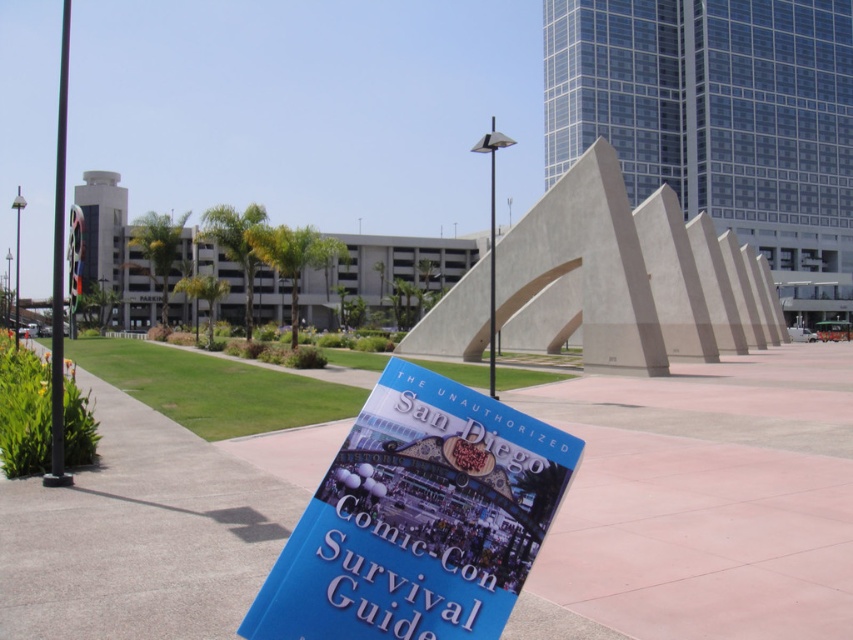
You are a photographer setting up a tripod to take a photo of the blue paper book at center and the black metal pole at left. The tripod has a maximum height adjustment of 1.5 meters. Considering their heights, will the tripod be able to capture both objects without needing to adjust its height?

The blue paper book at center is not as tall as the black metal pole at left, but since the tripod can be adjusted up to 1.5 meters, it should be capable of capturing both objects without needing to adjust its height as long as their heights are within this range.

You are a tourist holding a map and looking at the blue paper book at center and the metallic pole at center. The map shows that the sculpture ahead is 10 meters away. If you want to read the book without moving your feet, which object should you lean towards?

The blue paper book at center is located below the metallic pole at center, so you should lean towards the blue paper book at center to read it without moving your feet.

From the picture: You are standing at the origin of a coordinate system placed at the bottom left corner of the image. A point is marked at coordinate (418, 518). Which object is located at that point?

The point at coordinate (418, 518) corresponds to the blue paper book at center.